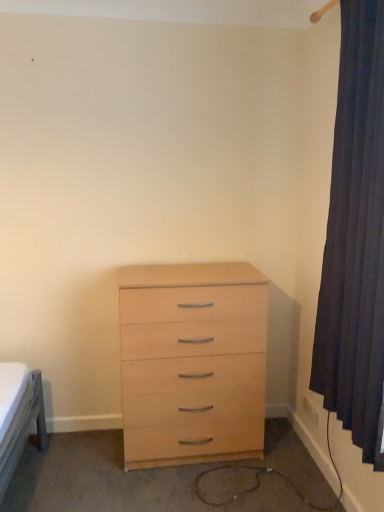
The width and height of the screenshot is (384, 512). What are the coordinates of `vacant space to the left of light wood chest of drawers at center` in the screenshot? It's located at [79, 460].